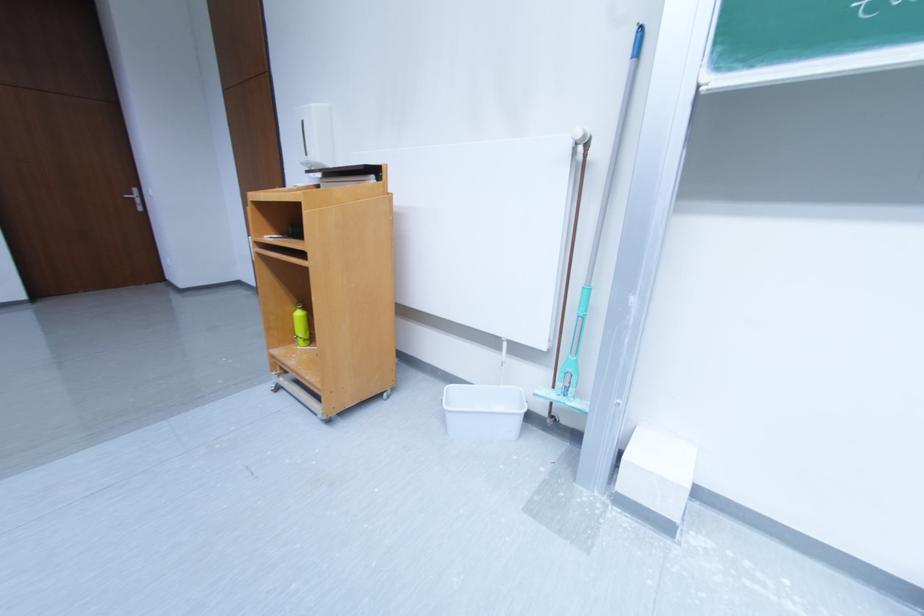
This screenshot has height=616, width=924. Find the location of `white block`. white block is located at coordinates (483, 411).